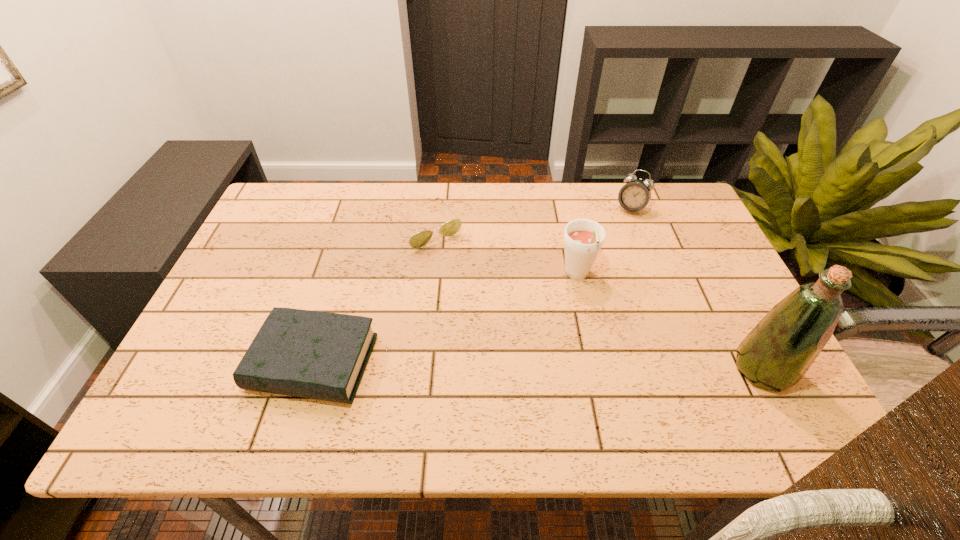
Where is `vacant space on the desktop that is between the Bible and the tallest object and is positioned on the drink side of the third object from right to left`? This screenshot has height=540, width=960. vacant space on the desktop that is between the Bible and the tallest object and is positioned on the drink side of the third object from right to left is located at coordinates (583, 367).

In order to click on free space on the desktop that is between the Bible and the rightmost object and is positioned on the front-facing side of the shortest object in this screenshot , I will do `click(540, 366)`.

Where is `vacant spot on the desktop that is between the Bible and the olive oil and is positioned on the face of the third shortest object`? The height and width of the screenshot is (540, 960). vacant spot on the desktop that is between the Bible and the olive oil and is positioned on the face of the third shortest object is located at coordinates pyautogui.click(x=545, y=366).